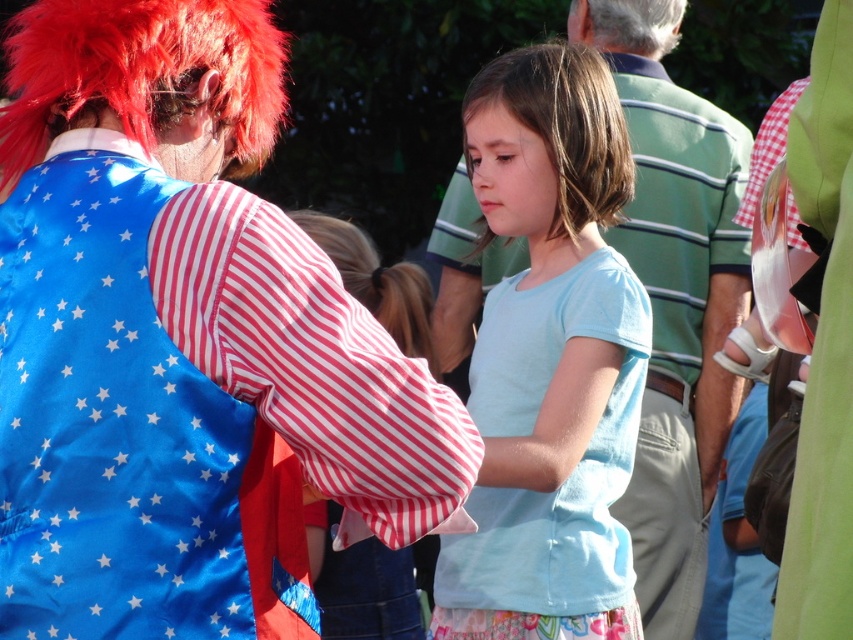
Question: Which point is farther to the camera?

Choices:
 (A) brown matte wig at center
 (B) green striped shirt at center
 (C) fluffy red wig at upper center

Answer: (C)

Question: Among these points, which one is nearest to the camera?

Choices:
 (A) (85, 349)
 (B) (364, 291)
 (C) (624, 6)
 (D) (614, 112)

Answer: (A)

Question: Which point is farther from the camera taking this photo?

Choices:
 (A) (602, 49)
 (B) (508, 106)
 (C) (329, 220)

Answer: (A)

Question: Considering the relative positions of light blue cotton dress at center and fluffy red wig at upper center in the image provided, where is light blue cotton dress at center located with respect to fluffy red wig at upper center?

Choices:
 (A) left
 (B) right

Answer: (A)

Question: Does brown matte wig at center come behind fluffy red wig at upper center?

Choices:
 (A) no
 (B) yes

Answer: (A)

Question: Does green striped shirt at center appear on the right side of fluffy red wig at upper center?

Choices:
 (A) yes
 (B) no

Answer: (A)